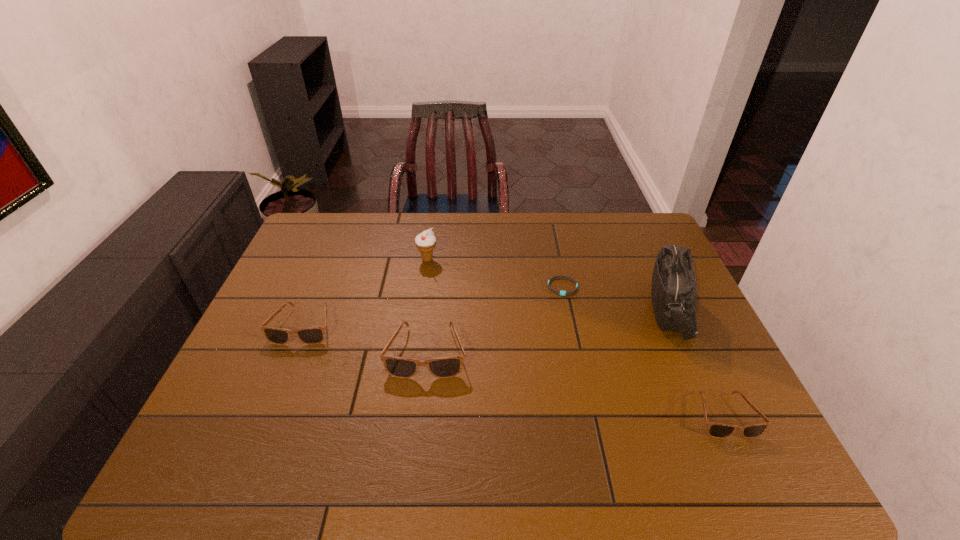
Locate an element on the screen. wristband is located at coordinates (563, 293).

At what (x,y) coordinates should I click in order to perform the action: click on vacant space situated on the frames of the leftmost sunglasses. Please return your answer as a coordinate pair (x, y). The height and width of the screenshot is (540, 960). Looking at the image, I should click on (278, 389).

The height and width of the screenshot is (540, 960). I want to click on vacant space situated at the front padded panel of the shoulder bag, so click(x=583, y=310).

The width and height of the screenshot is (960, 540). In order to click on vacant area situated 0.370m at the front padded panel of the shoulder bag in this screenshot , I will do tap(517, 310).

Locate an element on the screen. The height and width of the screenshot is (540, 960). vacant area situated 0.380m at the front padded panel of the shoulder bag is located at coordinates (514, 310).

Where is `free space located on the left of the farthest object`? This screenshot has height=540, width=960. free space located on the left of the farthest object is located at coordinates (374, 260).

You are a GUI agent. You are given a task and a screenshot of the screen. Output one action in this format:
    pyautogui.click(x=<x>, y=<y>)
    Task: Click on the free region located on the buckle of the wristband
    
    Given the screenshot: What is the action you would take?
    pyautogui.click(x=577, y=354)

The height and width of the screenshot is (540, 960). Find the location of `object positioned at the near edge`. object positioned at the near edge is located at coordinates (716, 430).

You are a GUI agent. You are given a task and a screenshot of the screen. Output one action in this format:
    pyautogui.click(x=<x>, y=<y>)
    Task: Click on the object that is at the left edge
    
    Given the screenshot: What is the action you would take?
    pyautogui.click(x=314, y=335)

The width and height of the screenshot is (960, 540). Find the location of `sunglasses present at the right edge`. sunglasses present at the right edge is located at coordinates (716, 430).